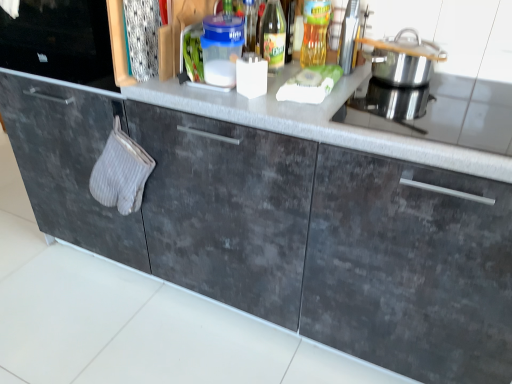
You are a GUI agent. You are given a task and a screenshot of the screen. Output one action in this format:
    pyautogui.click(x=<x>, y=<y>)
    Task: Click on the free space in front of translucent glass bottle at upper center, which ranks as the first bottle in left-to-right order
    The width and height of the screenshot is (512, 384).
    Given the screenshot: What is the action you would take?
    pyautogui.click(x=270, y=96)